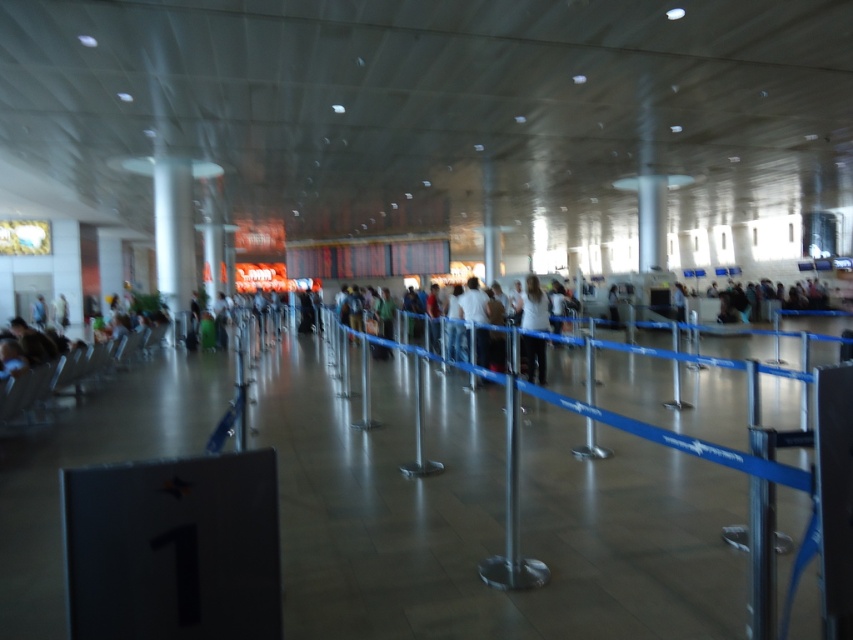
Who is positioned more to the left, blue rubber barrier at center or white matte shirt at center?

Positioned to the left is blue rubber barrier at center.

This screenshot has width=853, height=640. I want to click on blue rubber barrier at center, so click(503, 515).

Measure the distance between point (540, 356) and camera.

They are 9.21 meters apart.

The width and height of the screenshot is (853, 640). Describe the element at coordinates (532, 305) in the screenshot. I see `white matte shirt at center` at that location.

Locate an element on the screen. This screenshot has height=640, width=853. white matte shirt at center is located at coordinates (532, 305).

Which is above, blue rubber barrier at center or white shirt at center?

white shirt at center is higher up.

Is blue rubber barrier at center closer to camera compared to white shirt at center?

Yes, blue rubber barrier at center is closer to the viewer.

Locate an element on the screen. blue rubber barrier at center is located at coordinates (503, 515).